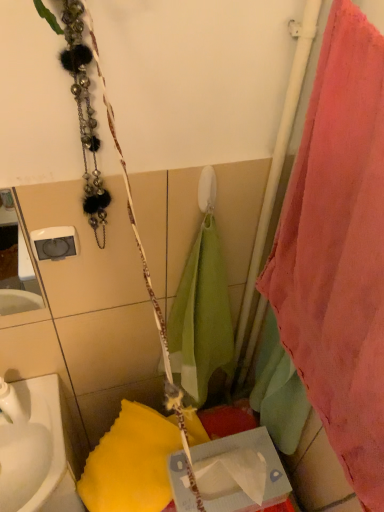
Question: Is cardboard tissue box at center directly adjacent to white glossy sink at lower left?

Choices:
 (A) no
 (B) yes

Answer: (A)

Question: Can you confirm if cardboard tissue box at center is bigger than white glossy sink at lower left?

Choices:
 (A) no
 (B) yes

Answer: (B)

Question: From the image's perspective, is cardboard tissue box at center located above white glossy sink at lower left?

Choices:
 (A) no
 (B) yes

Answer: (A)

Question: Is cardboard tissue box at center positioned with its back to white glossy sink at lower left?

Choices:
 (A) yes
 (B) no

Answer: (B)

Question: Does cardboard tissue box at center have a greater height compared to white glossy sink at lower left?

Choices:
 (A) no
 (B) yes

Answer: (B)

Question: From a real-world perspective, relative to white glossy sink at lower left, is pink fabric towel at right vertically above or below?

Choices:
 (A) above
 (B) below

Answer: (A)

Question: Is point (326, 314) positioned closer to the camera than point (9, 389)?

Choices:
 (A) closer
 (B) farther

Answer: (A)

Question: From the image's perspective, is pink fabric towel at right located above or below white glossy sink at lower left?

Choices:
 (A) below
 (B) above

Answer: (B)

Question: Is pink fabric towel at right in front of or behind white glossy sink at lower left in the image?

Choices:
 (A) behind
 (B) front

Answer: (B)

Question: Based on their sizes in the image, would you say pink fabric towel at right is bigger or smaller than cardboard tissue box at center?

Choices:
 (A) small
 (B) big

Answer: (B)

Question: Is pink fabric towel at right in front of or behind cardboard tissue box at center in the image?

Choices:
 (A) behind
 (B) front

Answer: (B)

Question: From the image's perspective, is pink fabric towel at right above or below cardboard tissue box at center?

Choices:
 (A) above
 (B) below

Answer: (A)

Question: Looking at their shapes, would you say pink fabric towel at right is wider or thinner than cardboard tissue box at center?

Choices:
 (A) thin
 (B) wide

Answer: (A)

Question: Considering the relative positions of white glossy sink at lower left and pink fabric towel at right in the image provided, is white glossy sink at lower left to the left or to the right of pink fabric towel at right?

Choices:
 (A) right
 (B) left

Answer: (B)

Question: Is white glossy sink at lower left bigger or smaller than pink fabric towel at right?

Choices:
 (A) big
 (B) small

Answer: (B)